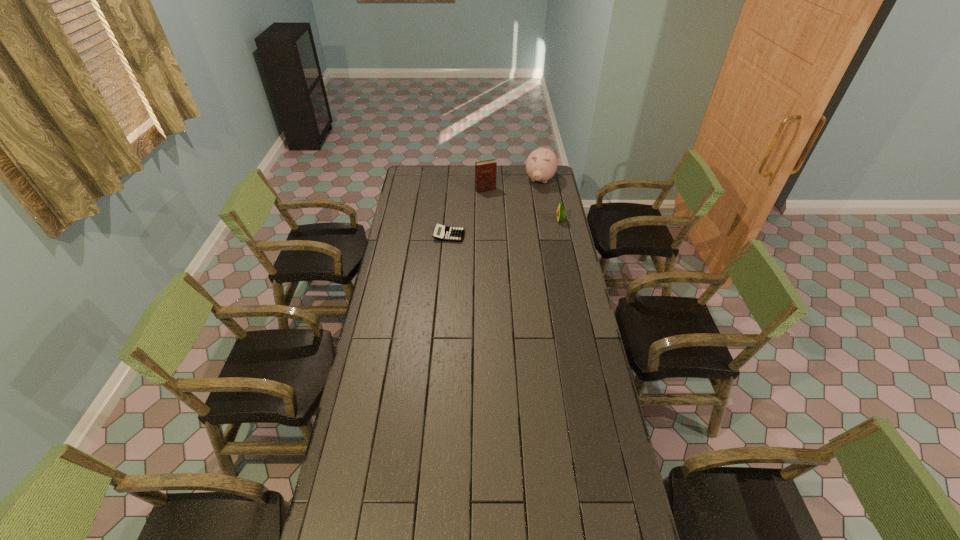
Where is `free space that is in between the piggy bank and the third farthest object`? The image size is (960, 540). free space that is in between the piggy bank and the third farthest object is located at coordinates (550, 200).

Where is `empty location between the second nearest object and the second object from left to right`? Image resolution: width=960 pixels, height=540 pixels. empty location between the second nearest object and the second object from left to right is located at coordinates (523, 205).

Locate an element on the screen. free area in between the diary and the avocado is located at coordinates (523, 205).

What are the coordinates of `free space that is in between the diary and the piggy bank` in the screenshot? It's located at (513, 185).

The height and width of the screenshot is (540, 960). In order to click on free point between the leftmost object and the piggy bank in this screenshot , I will do `click(494, 208)`.

Where is `the second closest object to the piggy bank`? This screenshot has width=960, height=540. the second closest object to the piggy bank is located at coordinates (561, 213).

The width and height of the screenshot is (960, 540). I want to click on the closest object to the shortest object, so click(485, 171).

Identify the location of vacant space that satisfies the following two spatial constraints: 1. on the front side of the diary; 2. on the cut side of the avocado. (486, 220).

I want to click on vacant area that satisfies the following two spatial constraints: 1. on the back side of the second object from left to right; 2. on the left side of the nearest object, so click(x=453, y=190).

Locate an element on the screen. This screenshot has height=540, width=960. free space that satisfies the following two spatial constraints: 1. on the front side of the avocado; 2. on the cut side of the piggy bank is located at coordinates (547, 220).